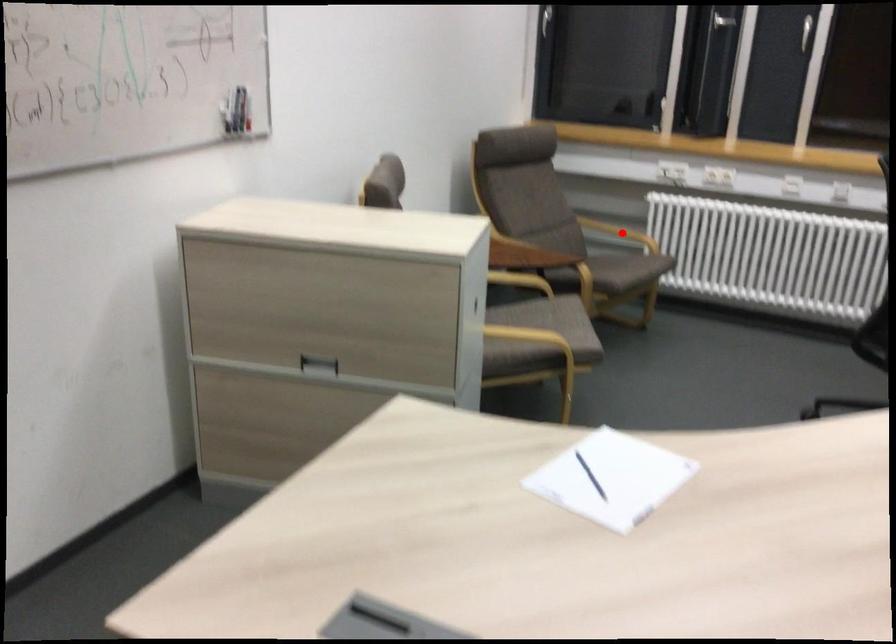
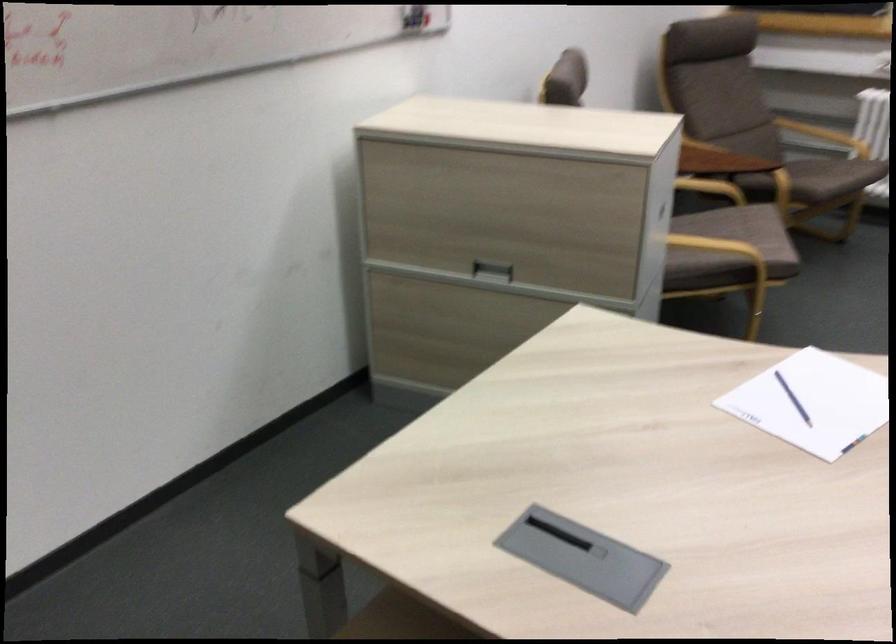
Find the pixel in the second image that matches the highlighted location in the first image.

(824, 136)